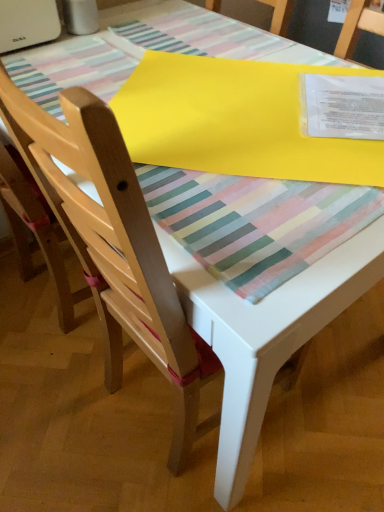
Question: Which direction should I rotate to look at matte wood chair at center, which is the first chair in right-to-left order, — up or down?

Choices:
 (A) down
 (B) up

Answer: (B)

Question: Considering the relative sizes of light wood chair at left, which is counted as the first chair, starting from the left, and yellow matte paper at upper center in the image provided, is light wood chair at left, which is counted as the first chair, starting from the left, thinner than yellow matte paper at upper center?

Choices:
 (A) no
 (B) yes

Answer: (B)

Question: From the image's perspective, is light wood chair at left, which is counted as the first chair, starting from the left, above yellow matte paper at upper center?

Choices:
 (A) yes
 (B) no

Answer: (B)

Question: Can you confirm if light wood chair at left, which is counted as the second chair, starting from the right, is taller than yellow matte paper at upper center?

Choices:
 (A) yes
 (B) no

Answer: (A)

Question: From a real-world perspective, is light wood chair at left, which is counted as the second chair, starting from the right, positioned over yellow matte paper at upper center based on gravity?

Choices:
 (A) no
 (B) yes

Answer: (A)

Question: From the image's perspective, is light wood chair at left, which is counted as the second chair, starting from the right, under yellow matte paper at upper center?

Choices:
 (A) yes
 (B) no

Answer: (A)

Question: Is light wood chair at left, which is counted as the second chair, starting from the right, bigger than yellow matte paper at upper center?

Choices:
 (A) no
 (B) yes

Answer: (B)

Question: Can you confirm if yellow matte paper at upper center is smaller than matte wood chair at center, which is the first chair in right-to-left order?

Choices:
 (A) yes
 (B) no

Answer: (A)

Question: Does yellow matte paper at upper center have a greater width compared to matte wood chair at center, the second chair in the left-to-right sequence?

Choices:
 (A) yes
 (B) no

Answer: (B)

Question: Considering the relative sizes of yellow matte paper at upper center and matte wood chair at center, the second chair in the left-to-right sequence, in the image provided, is yellow matte paper at upper center taller than matte wood chair at center, the second chair in the left-to-right sequence,?

Choices:
 (A) no
 (B) yes

Answer: (A)

Question: Are yellow matte paper at upper center and matte wood chair at center, which is the first chair in right-to-left order, located far from each other?

Choices:
 (A) yes
 (B) no

Answer: (B)

Question: Is yellow matte paper at upper center in contact with matte wood chair at center, the second chair in the left-to-right sequence?

Choices:
 (A) yes
 (B) no

Answer: (B)

Question: Does yellow matte paper at upper center turn towards matte wood chair at center, which is the first chair in right-to-left order?

Choices:
 (A) yes
 (B) no

Answer: (B)

Question: From a real-world perspective, is matte wood chair at center, which is the first chair in right-to-left order, on top of light wood chair at left, which is counted as the first chair, starting from the left?

Choices:
 (A) yes
 (B) no

Answer: (B)